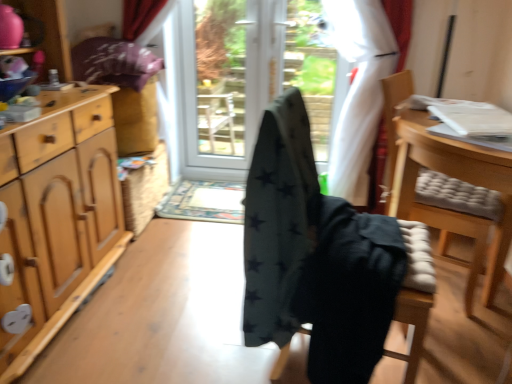
This screenshot has width=512, height=384. What do you see at coordinates (57, 214) in the screenshot?
I see `light wood cabinet at left` at bounding box center [57, 214].

Measure the distance between dark gray fabric chair at center, which is counted as the third chair, starting from the right, and camera.

A distance of 1.09 meters exists between dark gray fabric chair at center, which is counted as the third chair, starting from the right, and camera.

The width and height of the screenshot is (512, 384). What are the coordinates of `black fabric screen door at center, which is the first screen door from right to left` in the screenshot? It's located at point(236,86).

Image resolution: width=512 pixels, height=384 pixels. What are the coordinates of `white glossy screen door at center, which is the second screen door from right to left` in the screenshot? It's located at (219, 81).

In order to face wooden cushioned chair at right, placed as the third chair when sorted from left to right, should I rotate leftwards or rightwards?

Turn right approximately 23.918 degrees to face it.

Where is `dark green fabric chair at center, positioned as the 2th chair in left-to-right order`? Image resolution: width=512 pixels, height=384 pixels. dark green fabric chair at center, positioned as the 2th chair in left-to-right order is located at coordinates (415, 295).

Is dark gray fabric chair at center, which is the first chair from left to right, positioned in front of wooden cushioned chair at right, placed as the third chair when sorted from left to right?

Yes, it is in front of wooden cushioned chair at right, placed as the third chair when sorted from left to right.

Considering the positions of point (319, 311) and point (451, 165), is point (319, 311) closer or farther from the camera than point (451, 165)?

Point (319, 311) is positioned closer to the camera compared to point (451, 165).

From a real-world perspective, is dark gray fabric chair at center, which is counted as the third chair, starting from the right, located beneath wooden cushioned chair at right, placed as the third chair when sorted from left to right?

No.

Can we say dark gray fabric chair at center, which is counted as the third chair, starting from the right, lies outside wooden cushioned chair at right, the 1th chair positioned from the right?

Yes.

Which object is positioned more to the left, wooden cushioned chair at right, the 1th chair positioned from the right, or white glossy screen door at center, which is the 1th screen door from left to right?

Positioned to the left is white glossy screen door at center, which is the 1th screen door from left to right.

Considering the sizes of objects wooden cushioned chair at right, placed as the third chair when sorted from left to right, and white glossy screen door at center, which is the 1th screen door from left to right, in the image provided, who is thinner, wooden cushioned chair at right, placed as the third chair when sorted from left to right, or white glossy screen door at center, which is the 1th screen door from left to right,?

white glossy screen door at center, which is the 1th screen door from left to right.

From the picture: Would you consider wooden cushioned chair at right, placed as the third chair when sorted from left to right, to be distant from white glossy screen door at center, which is the 1th screen door from left to right?

Yes, wooden cushioned chair at right, placed as the third chair when sorted from left to right, and white glossy screen door at center, which is the 1th screen door from left to right, are quite far apart.

Does point (471, 268) come in front of point (253, 112)?

That is True.

How much distance is there between dark gray fabric chair at center, which is the first chair from left to right, and light wood cabinet at left?

dark gray fabric chair at center, which is the first chair from left to right, and light wood cabinet at left are 34.56 inches apart from each other.

Based on their sizes in the image, would you say dark gray fabric chair at center, which is the first chair from left to right, is bigger or smaller than light wood cabinet at left?

dark gray fabric chair at center, which is the first chair from left to right, is smaller than light wood cabinet at left.

Does dark gray fabric chair at center, which is counted as the third chair, starting from the right, touch light wood cabinet at left?

No, dark gray fabric chair at center, which is counted as the third chair, starting from the right, is not touching light wood cabinet at left.

Is dark gray fabric chair at center, which is the first chair from left to right, completely or partially outside of light wood cabinet at left?

Yes.

Is wooden cushioned chair at right, the 1th chair positioned from the right, positioned with its back to dark gray fabric chair at center, which is the first chair from left to right?

Yes, wooden cushioned chair at right, the 1th chair positioned from the right, is facing away from dark gray fabric chair at center, which is the first chair from left to right.

Is wooden cushioned chair at right, the 1th chair positioned from the right, bigger or smaller than dark gray fabric chair at center, which is counted as the third chair, starting from the right?

In the image, wooden cushioned chair at right, the 1th chair positioned from the right, appears to be larger than dark gray fabric chair at center, which is counted as the third chair, starting from the right.

From the image's perspective, is wooden cushioned chair at right, the 1th chair positioned from the right, under dark gray fabric chair at center, which is the first chair from left to right?

No, from the image's perspective, wooden cushioned chair at right, the 1th chair positioned from the right, is not below dark gray fabric chair at center, which is the first chair from left to right.

Is wooden cushioned chair at right, placed as the third chair when sorted from left to right, inside the boundaries of dark gray fabric chair at center, which is the first chair from left to right, or outside?

wooden cushioned chair at right, placed as the third chair when sorted from left to right, is spatially situated outside dark gray fabric chair at center, which is the first chair from left to right.

From the image's perspective, is white glossy screen door at center, which is the second screen door from right to left, over wooden cushioned chair at right, the 1th chair positioned from the right?

Yes, from the image's perspective, white glossy screen door at center, which is the second screen door from right to left, is on top of wooden cushioned chair at right, the 1th chair positioned from the right.

Considering the sizes of white glossy screen door at center, which is the second screen door from right to left, and wooden cushioned chair at right, placed as the third chair when sorted from left to right, in the image, is white glossy screen door at center, which is the second screen door from right to left, bigger or smaller than wooden cushioned chair at right, placed as the third chair when sorted from left to right,?

white glossy screen door at center, which is the second screen door from right to left, is smaller than wooden cushioned chair at right, placed as the third chair when sorted from left to right.

From a real-world perspective, which screen door is the 2nd one above the wooden cushioned chair at right, the 1th chair positioned from the right? Please provide its 2D coordinates.

[(219, 81)]

Measure the distance from white glossy screen door at center, which is the second screen door from right to left, to wooden cushioned chair at right, placed as the third chair when sorted from left to right.

white glossy screen door at center, which is the second screen door from right to left, and wooden cushioned chair at right, placed as the third chair when sorted from left to right, are 4.92 feet apart.

Does black fabric screen door at center, arranged as the 2th screen door when viewed from the left, have a greater width compared to light wood cabinet at left?

No, black fabric screen door at center, arranged as the 2th screen door when viewed from the left, is not wider than light wood cabinet at left.

Is the depth of black fabric screen door at center, arranged as the 2th screen door when viewed from the left, greater than that of light wood cabinet at left?

Yes, black fabric screen door at center, arranged as the 2th screen door when viewed from the left, is further from the viewer.

Which is closer, (185, 102) or (106, 152)?

Clearly, point (185, 102) is more distant from the camera than point (106, 152).

Could you measure the distance between black fabric screen door at center, which is the first screen door from right to left, and light wood cabinet at left?

black fabric screen door at center, which is the first screen door from right to left, and light wood cabinet at left are 4.43 feet apart.

Between point (495, 283) and point (321, 162), which one is positioned behind?

Point (321, 162)

Can you confirm if wooden cushioned chair at right, the 1th chair positioned from the right, is bigger than black fabric screen door at center, which is the first screen door from right to left?

Correct, wooden cushioned chair at right, the 1th chair positioned from the right, is larger in size than black fabric screen door at center, which is the first screen door from right to left.

Can you confirm if wooden cushioned chair at right, placed as the third chair when sorted from left to right, is wider than black fabric screen door at center, arranged as the 2th screen door when viewed from the left?

Yes.

Is wooden cushioned chair at right, the 1th chair positioned from the right, taller than black fabric screen door at center, arranged as the 2th screen door when viewed from the left?

Incorrect, the height of wooden cushioned chair at right, the 1th chair positioned from the right, is not larger of that of black fabric screen door at center, arranged as the 2th screen door when viewed from the left.

Where is `the 2nd chair to the left of the wooden cushioned chair at right, the 1th chair positioned from the right, starting your count from the anchor`? The height and width of the screenshot is (384, 512). the 2nd chair to the left of the wooden cushioned chair at right, the 1th chair positioned from the right, starting your count from the anchor is located at coordinates (315, 256).

At what (x,y) coordinates should I click in order to perform the action: click on the 2nd screen door positioned above the wooden cushioned chair at right, the 1th chair positioned from the right (from the image's perspective). Please return your answer as a coordinate pair (x, y). This screenshot has width=512, height=384. Looking at the image, I should click on (219, 81).

When comparing their distances from light wood cabinet at left, does black fabric screen door at center, arranged as the 2th screen door when viewed from the left, or white glossy screen door at center, which is the 1th screen door from left to right, seem closer?

The object closer to light wood cabinet at left is black fabric screen door at center, arranged as the 2th screen door when viewed from the left.

Looking at the image, which one is located further to dark gray fabric chair at center, which is counted as the third chair, starting from the right, white glossy screen door at center, which is the 1th screen door from left to right, or wooden cushioned chair at right, the 1th chair positioned from the right?

white glossy screen door at center, which is the 1th screen door from left to right, is further to dark gray fabric chair at center, which is counted as the third chair, starting from the right.

From the image, which object appears to be nearer to dark gray fabric chair at center, which is the first chair from left to right, light wood cabinet at left or white glossy screen door at center, which is the second screen door from right to left?

Based on the image, light wood cabinet at left appears to be nearer to dark gray fabric chair at center, which is the first chair from left to right.

Considering their positions, is wooden cushioned chair at right, the 1th chair positioned from the right, positioned further to light wood cabinet at left than dark gray fabric chair at center, which is counted as the third chair, starting from the right?

Among the two, wooden cushioned chair at right, the 1th chair positioned from the right, is located further to light wood cabinet at left.

Based on their spatial positions, is dark green fabric chair at center, positioned as the 2th chair in right-to-left order, or dark gray fabric chair at center, which is counted as the third chair, starting from the right, further from black fabric screen door at center, arranged as the 2th screen door when viewed from the left?

Based on the image, dark green fabric chair at center, positioned as the 2th chair in right-to-left order, appears to be further to black fabric screen door at center, arranged as the 2th screen door when viewed from the left.

Based on their spatial positions, is wooden cushioned chair at right, the 1th chair positioned from the right, or light wood cabinet at left further from black fabric screen door at center, arranged as the 2th screen door when viewed from the left?

Based on the image, light wood cabinet at left appears to be further to black fabric screen door at center, arranged as the 2th screen door when viewed from the left.

Based on the photo, based on their spatial positions, is black fabric screen door at center, which is the first screen door from right to left, or dark green fabric chair at center, positioned as the 2th chair in right-to-left order, further from dark gray fabric chair at center, which is the first chair from left to right?

The object further to dark gray fabric chair at center, which is the first chair from left to right, is black fabric screen door at center, which is the first screen door from right to left.

Consider the image. When comparing their distances from dark gray fabric chair at center, which is the first chair from left to right, does dark green fabric chair at center, positioned as the 2th chair in left-to-right order, or light wood cabinet at left seem further?

light wood cabinet at left.

Where is `chair between dark green fabric chair at center, positioned as the 2th chair in right-to-left order, and white glossy screen door at center, which is the second screen door from right to left, along the z-axis`? chair between dark green fabric chair at center, positioned as the 2th chair in right-to-left order, and white glossy screen door at center, which is the second screen door from right to left, along the z-axis is located at coordinates (451, 177).

Identify the location of screen door between dark gray fabric chair at center, which is counted as the third chair, starting from the right, and white glossy screen door at center, which is the 1th screen door from left to right, from front to back. This screenshot has width=512, height=384. (236, 86).

Where is `chair between dark green fabric chair at center, positioned as the 2th chair in left-to-right order, and black fabric screen door at center, which is the first screen door from right to left, from front to back`? chair between dark green fabric chair at center, positioned as the 2th chair in left-to-right order, and black fabric screen door at center, which is the first screen door from right to left, from front to back is located at coordinates (451, 177).

Locate an element on the screen. The image size is (512, 384). chair situated between dark gray fabric chair at center, which is counted as the third chair, starting from the right, and wooden cushioned chair at right, placed as the third chair when sorted from left to right, from left to right is located at coordinates (415, 295).